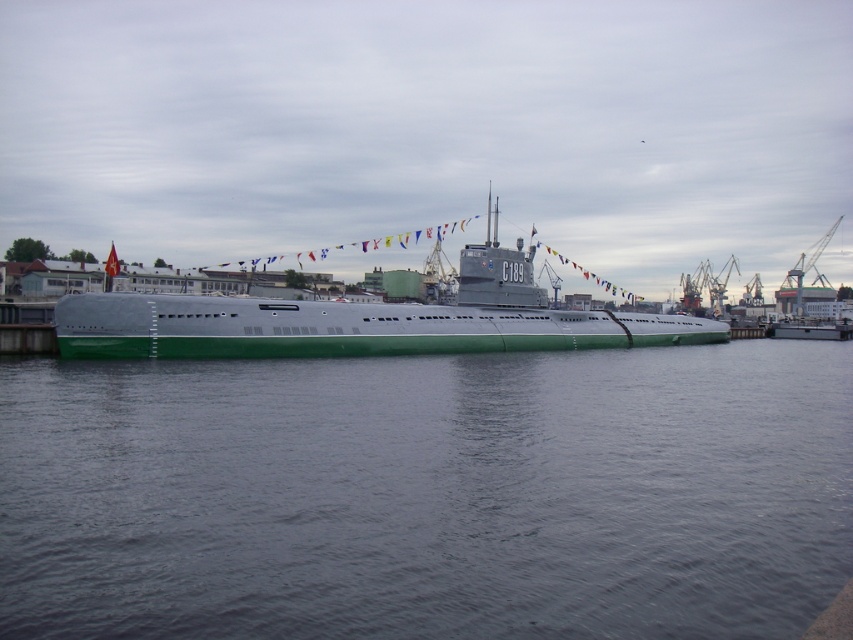
You are a naval architect inspecting the submarine docked at the port. You need to determine if the green matte water at center can accommodate the width of the green matte submarine at center. Based on the scene, what is your assessment?

The green matte water at center has a lesser width compared to the green matte submarine at center, so the water is narrower than the submarine. Therefore, the submarine cannot be fully accommodated in the width of the green matte water at center.

You are a naval architect inspecting the submarine docked at the port. You notice the green matte water at center and the green matte submarine at center. Which one takes up more space in the image?

The green matte submarine at center occupies more space than the green matte water at center according to the description.

From the picture: You are a naval architect inspecting the submarine. You need to determine if the green matte submarine at center can be submerged further into the green matte water at center. Based on their heights, can it submerge completely?

The green matte water at center is shorter than the green matte submarine at center, so the submarine cannot be submerged completely as the water is not deep enough.